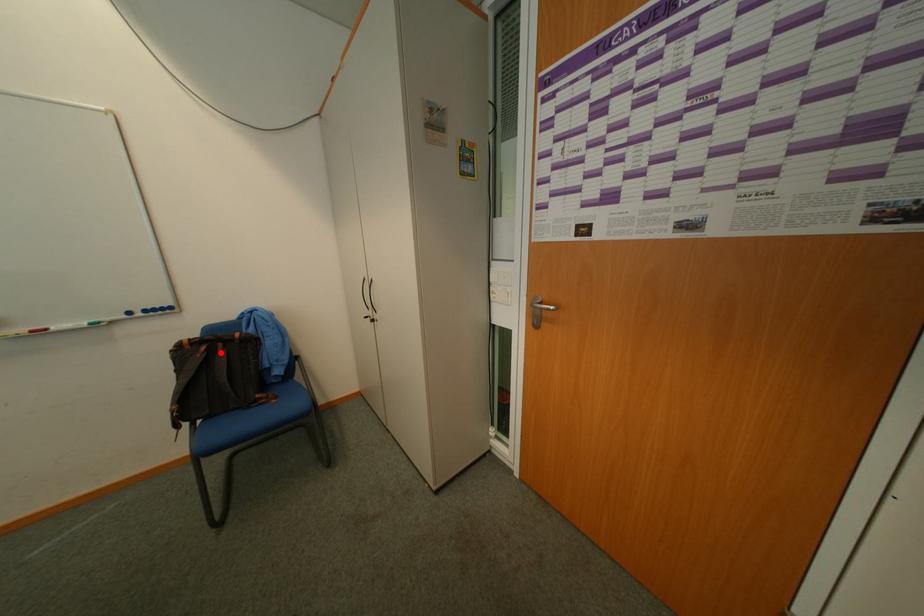
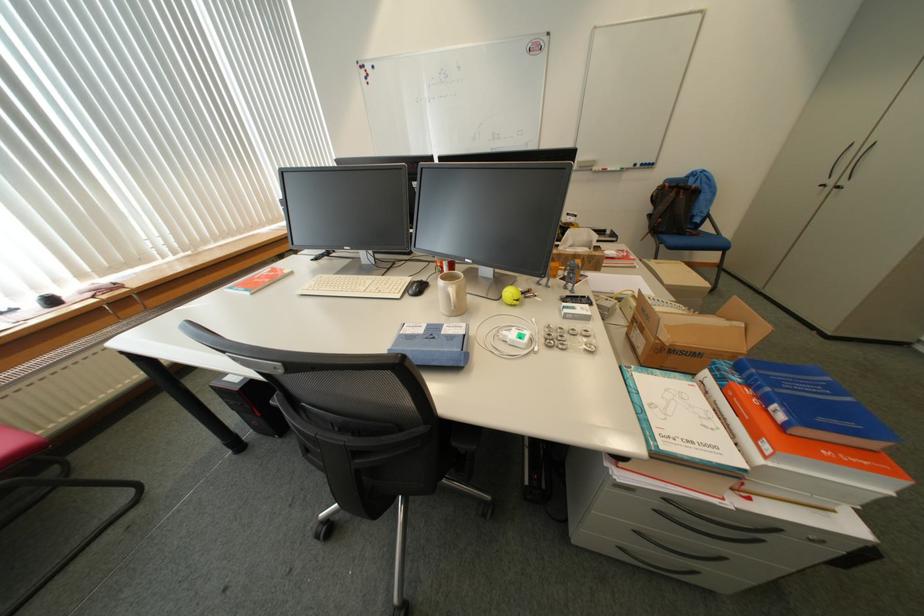
Where in the second image is the point corresponding to the highlighted location from the first image?

(687, 195)